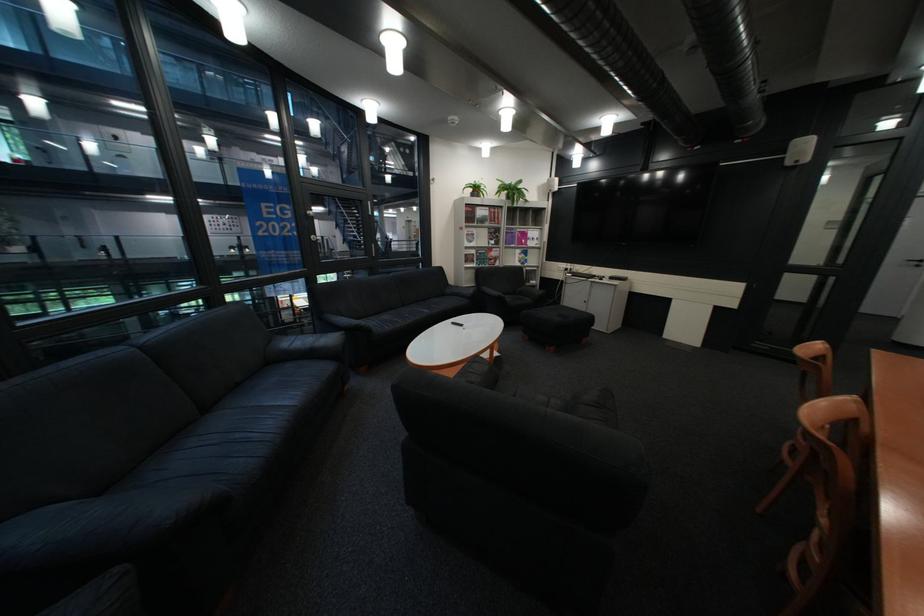
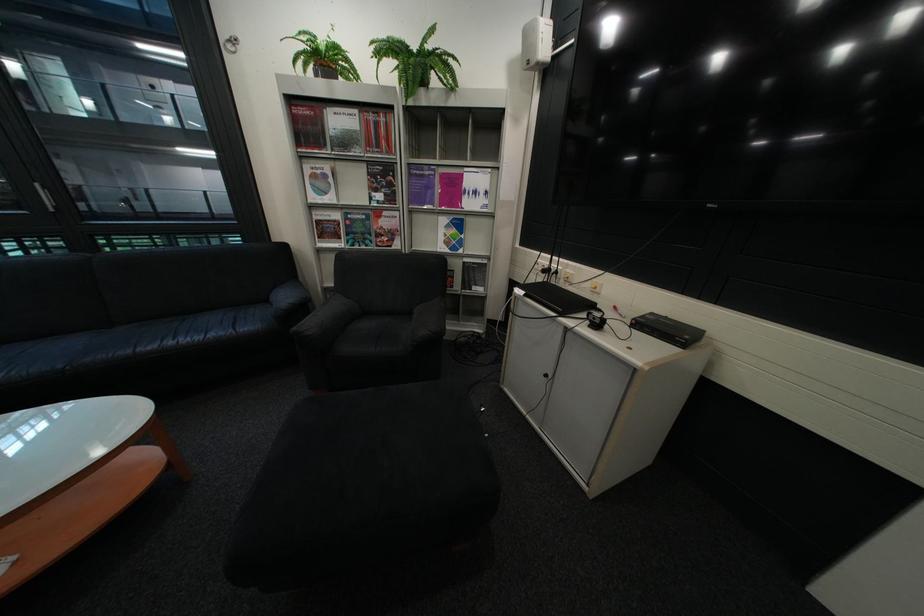
What movement of the cameraman would produce the second image?

The movement direction of the cameraman is right, forward.